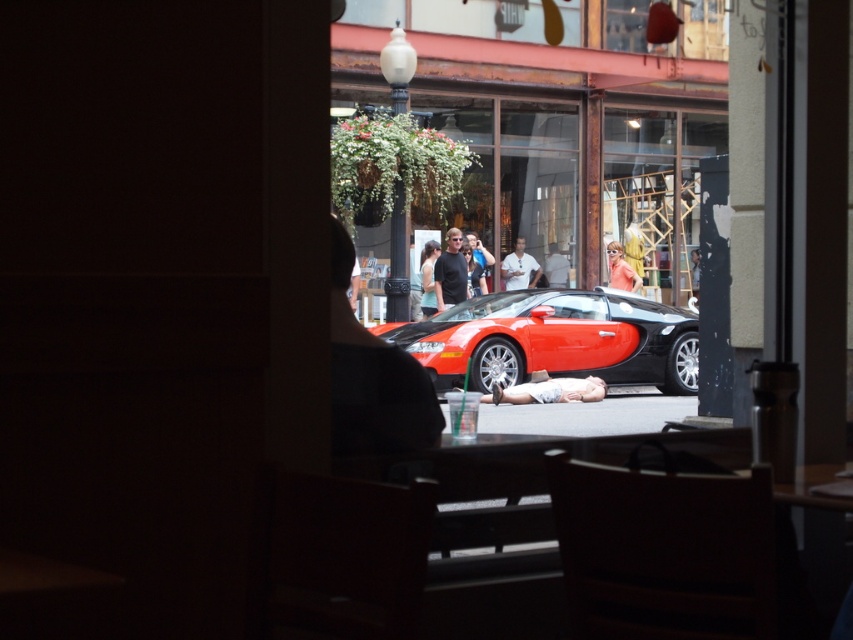
Does black textured shirt at center have a greater width compared to matte black tank top at center?

Indeed, black textured shirt at center has a greater width compared to matte black tank top at center.

Between point (440, 285) and point (430, 292), which one is positioned in front?

Positioned in front is point (440, 285).

Locate an element on the screen. black textured shirt at center is located at coordinates (450, 273).

Looking at this image, does matte black tank top at center appear on the left side of orange fabric dress at center?

Yes, matte black tank top at center is to the left of orange fabric dress at center.

Does matte black tank top at center have a smaller size compared to orange fabric dress at center?

Yes, matte black tank top at center is smaller than orange fabric dress at center.

Does point (426, 314) come in front of point (619, 260)?

Yes, it is.

Where is `matte black tank top at center`? The height and width of the screenshot is (640, 853). matte black tank top at center is located at coordinates (428, 276).

Is shiny red/black car at center above black textured shirt at center?

No.

Between shiny red/black car at center and black textured shirt at center, which one has less height?

Answer: With less height is black textured shirt at center.

The width and height of the screenshot is (853, 640). I want to click on shiny red/black car at center, so click(x=554, y=339).

Where is `shiny red/black car at center`? shiny red/black car at center is located at coordinates (554, 339).